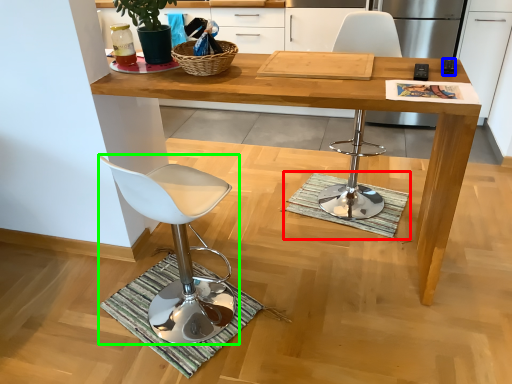
Question: Which object is positioned closest to doormat (highlighted by a red box)? Select from remote control (highlighted by a blue box) and chair (highlighted by a green box).

Choices:
 (A) remote control
 (B) chair

Answer: (B)